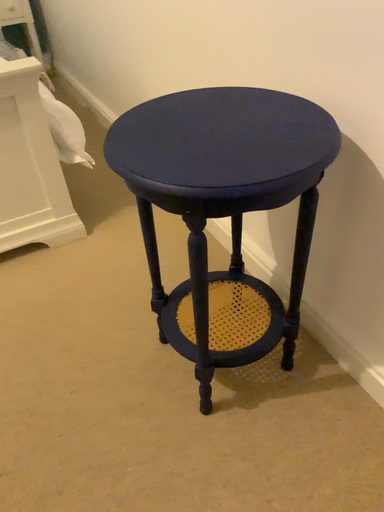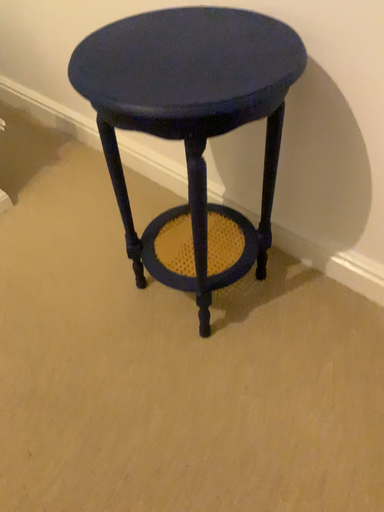
Question: Which way did the camera rotate in the video?

Choices:
 (A) rotated left
 (B) rotated right

Answer: (B)